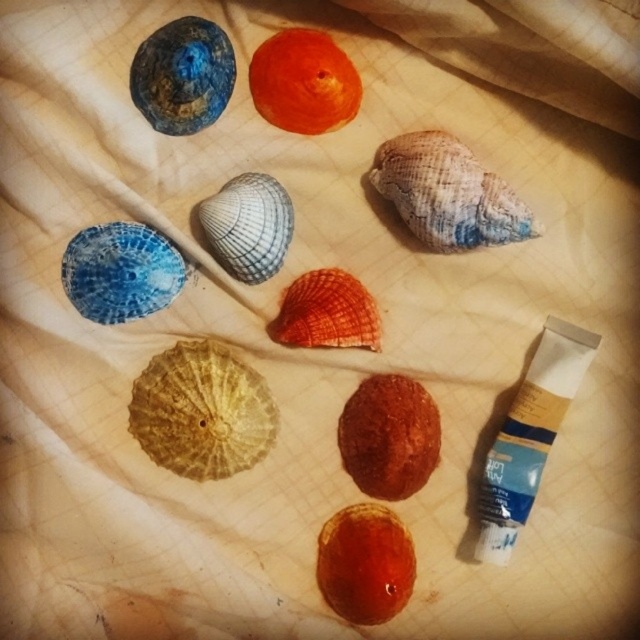
You are an artist preparing to paint a seascape. You have two shells in front of you on the fabric background. The glossy orange shell at center and the orange matte shell at upper center. Which shell should you choose if you want to depict a larger shell in your painting?

The glossy orange shell at center is larger in size than the orange matte shell at upper center, so you should choose the glossy orange shell at center for depicting a larger shell in your painting.

Looking at this image, you are an artist trying to paint the seashell arrangement. You want to place a new shell at point (365, 563). What shell is already at that location?

The glossy orange shell at center is located at point (365, 563).